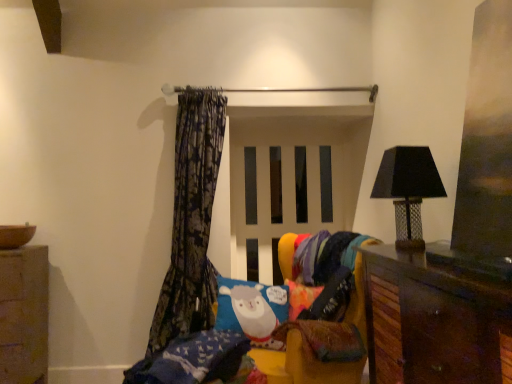
Question: Is dark floral fabric curtain at left further to camera compared to black mesh lampshade at right?

Choices:
 (A) yes
 (B) no

Answer: (A)

Question: Can you confirm if dark floral fabric curtain at left is thinner than black mesh lampshade at right?

Choices:
 (A) no
 (B) yes

Answer: (A)

Question: Is dark floral fabric curtain at left to the left of black mesh lampshade at right from the viewer's perspective?

Choices:
 (A) no
 (B) yes

Answer: (B)

Question: Does dark floral fabric curtain at left turn towards black mesh lampshade at right?

Choices:
 (A) yes
 (B) no

Answer: (B)

Question: From a real-world perspective, is dark floral fabric curtain at left located higher than black mesh lampshade at right?

Choices:
 (A) no
 (B) yes

Answer: (A)

Question: Can you confirm if dark floral fabric curtain at left is taller than black mesh lampshade at right?

Choices:
 (A) no
 (B) yes

Answer: (B)

Question: Is black mesh lampshade at right facing away from soft plush bed at center?

Choices:
 (A) no
 (B) yes

Answer: (A)

Question: From the image's perspective, is black mesh lampshade at right below soft plush bed at center?

Choices:
 (A) no
 (B) yes

Answer: (A)

Question: Would you say black mesh lampshade at right is outside soft plush bed at center?

Choices:
 (A) yes
 (B) no

Answer: (A)

Question: Is black mesh lampshade at right beside soft plush bed at center?

Choices:
 (A) yes
 (B) no

Answer: (B)

Question: Is black mesh lampshade at right surrounding soft plush bed at center?

Choices:
 (A) yes
 (B) no

Answer: (B)

Question: From the image's perspective, is black mesh lampshade at right located above soft plush bed at center?

Choices:
 (A) no
 (B) yes

Answer: (B)

Question: Does smooth stone cabinet at lower left have a larger size compared to multicolored knitted blanket at lower right?

Choices:
 (A) yes
 (B) no

Answer: (A)